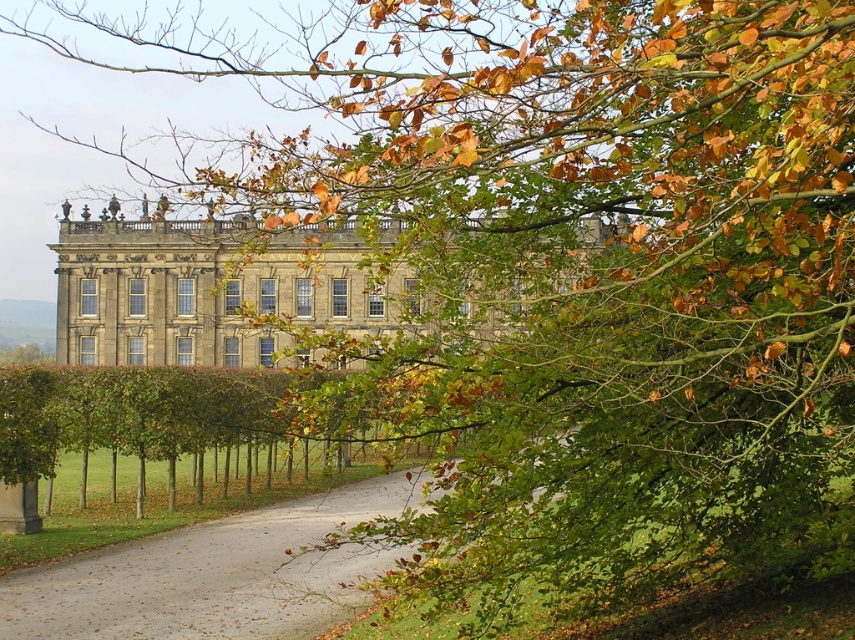
You are standing at the entrance of the mansion and want to walk to the green leafy hedge at center. Which direction should you walk relative to the gray gravel driveway at center?

The gray gravel driveway at center is closer to the viewer than the green leafy hedge at center. To reach the green leafy hedge at center, you should walk forward away from the gray gravel driveway at center towards the hedge.